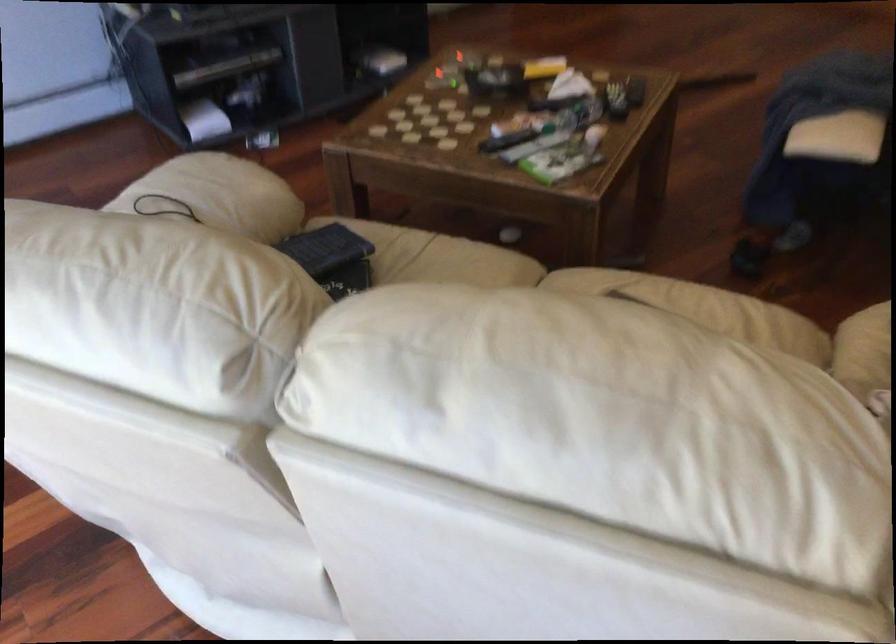
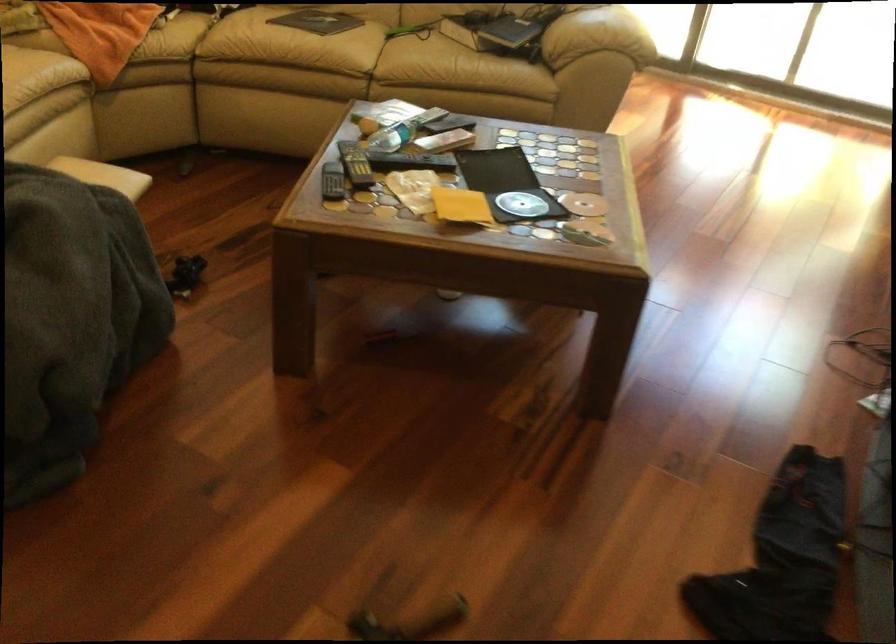
Where in the second image is the point corresponding to the point at 495,71 from the first image?

(521, 204)